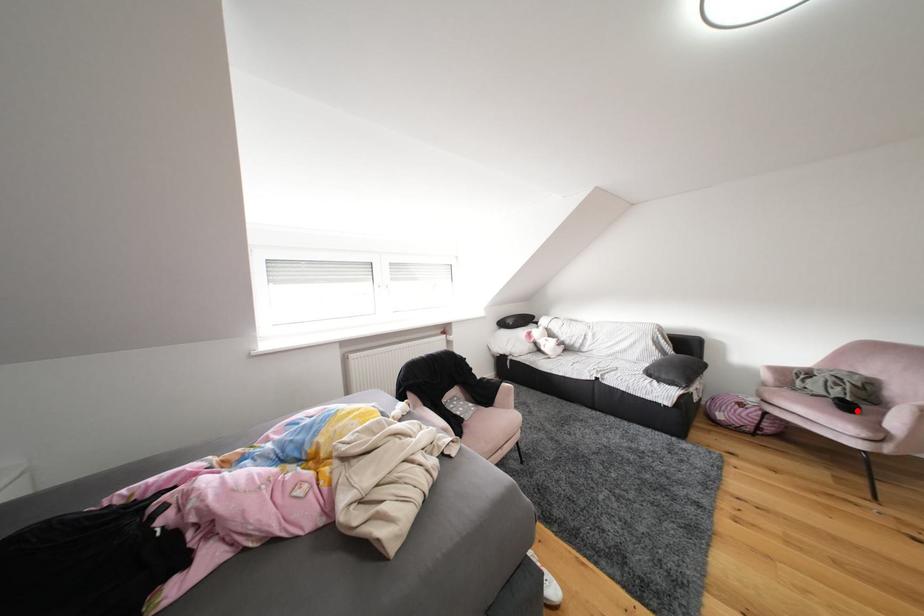
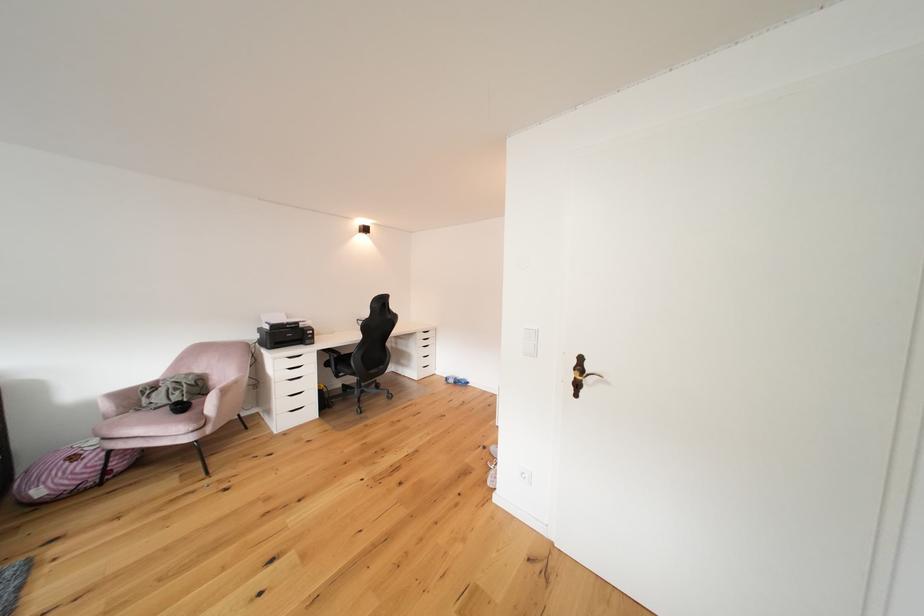
Question: I am providing you with two images of the same scene from different viewpoints. Given a red point in image1, look at the same physical point in image2. Is it:

Choices:
 (A) Closer to the viewpoint
 (B) Farther from the viewpoint

Answer: (B)